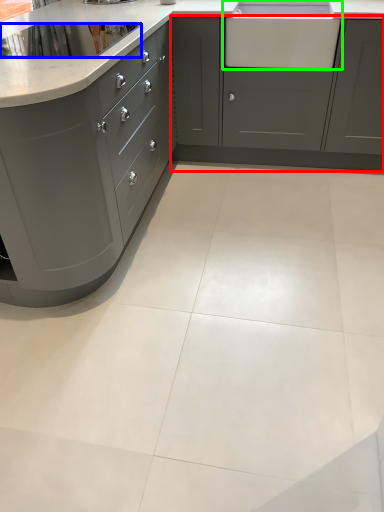
Question: Estimate the real-world distances between objects in this image. Which object is closer to cabinetry (highlighted by a red box), appliance (highlighted by a blue box) or sink (highlighted by a green box)?

Choices:
 (A) appliance
 (B) sink

Answer: (B)